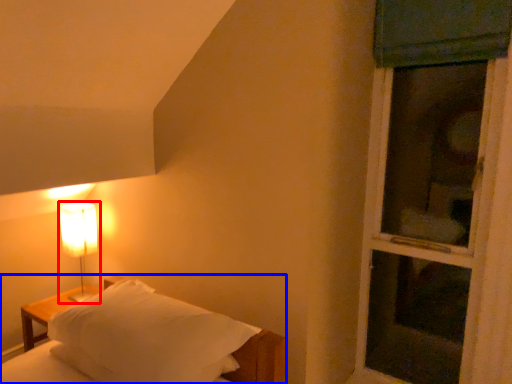
Question: Which object is closer to the camera taking this photo, lamp (highlighted by a red box) or bed (highlighted by a blue box)?

Choices:
 (A) lamp
 (B) bed

Answer: (B)